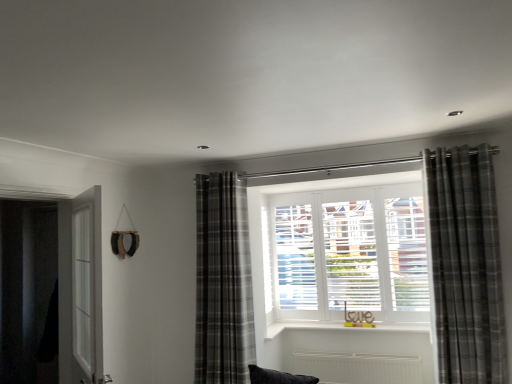
Identify the location of gray plaid curtain at right, which ranks as the 1th curtain in right-to-left order. The image size is (512, 384). (466, 265).

What do you see at coordinates (223, 281) in the screenshot?
I see `gray plaid curtain at center, the 2th curtain in the front-to-back sequence` at bounding box center [223, 281].

Measure the distance between gray plaid curtain at center, the 2th curtain in the front-to-back sequence, and camera.

The depth of gray plaid curtain at center, the 2th curtain in the front-to-back sequence, is 3.10 meters.

At what (x,y) coordinates should I click in order to perform the action: click on gray plaid curtain at right, the second curtain from the back. Please return your answer as a coordinate pair (x, y). Image resolution: width=512 pixels, height=384 pixels. Looking at the image, I should click on (466, 265).

Is black matte door at left surrounding gray plaid curtain at right, the second curtain from the back?

No.

Measure the distance from black matte door at left to gray plaid curtain at right, which appears as the 2th curtain when viewed from the left.

They are 8.54 feet apart.

From the image's perspective, is black matte door at left on top of gray plaid curtain at right, which appears as the 2th curtain when viewed from the left?

No.

Based on the photo, considering the positions of objects black matte door at left and gray plaid curtain at right, which appears as the 1th curtain when viewed from the front, in the image provided, who is behind, black matte door at left or gray plaid curtain at right, which appears as the 1th curtain when viewed from the front,?

gray plaid curtain at right, which appears as the 1th curtain when viewed from the front, is more distant.

In the scene shown: How different are the orientations of gray plaid curtain at center, which ranks as the 1th curtain in back-to-front order, and black matte door at left in degrees?

94 degrees separate the facing orientations of gray plaid curtain at center, which ranks as the 1th curtain in back-to-front order, and black matte door at left.

From the image's perspective, is gray plaid curtain at center, which ranks as the 1th curtain in back-to-front order, positioned above or below black matte door at left?

gray plaid curtain at center, which ranks as the 1th curtain in back-to-front order, is below black matte door at left.

Does point (199, 230) come closer to viewer compared to point (32, 247)?

Yes, point (199, 230) is closer to viewer.

Is gray plaid curtain at center, placed as the 1th curtain when sorted from left to right, to the left or to the right of black matte door at left in the image?

In the image, gray plaid curtain at center, placed as the 1th curtain when sorted from left to right, appears on the right side of black matte door at left.

Which is in front, gray plaid curtain at right, which appears as the 1th curtain when viewed from the front, or clear glass screen door at left?

Positioned in front is clear glass screen door at left.

Would you say clear glass screen door at left is part of gray plaid curtain at right, which appears as the 1th curtain when viewed from the front,'s contents?

No, gray plaid curtain at right, which appears as the 1th curtain when viewed from the front, does not contain clear glass screen door at left.

Can you confirm if gray plaid curtain at right, the second curtain from the back, is taller than clear glass screen door at left?

Yes.

Identify the location of curtain on the left of gray plaid curtain at right, which appears as the 2th curtain when viewed from the left. The image size is (512, 384). (223, 281).

From the image's perspective, is gray plaid curtain at right, which ranks as the 1th curtain in right-to-left order, on top of gray plaid curtain at center, which ranks as the 1th curtain in back-to-front order?

Yes, from the image's perspective, gray plaid curtain at right, which ranks as the 1th curtain in right-to-left order, is above gray plaid curtain at center, which ranks as the 1th curtain in back-to-front order.

Considering the positions of objects gray plaid curtain at right, which appears as the 1th curtain when viewed from the front, and gray plaid curtain at center, positioned as the second curtain in right-to-left order, in the image provided, who is more to the right, gray plaid curtain at right, which appears as the 1th curtain when viewed from the front, or gray plaid curtain at center, positioned as the second curtain in right-to-left order,?

gray plaid curtain at right, which appears as the 1th curtain when viewed from the front.

Which is nearer, (446, 226) or (245, 276)?

The point (446, 226) is in front.

Does point (99, 191) lie behind point (59, 228)?

No, (99, 191) is closer to viewer.

Can you tell me how much clear glass screen door at left and black matte door at left differ in facing direction?

129 degrees.

From a real-world perspective, between clear glass screen door at left and black matte door at left, who is vertically higher?

black matte door at left.

Which object is wider, clear glass screen door at left or black matte door at left?

black matte door at left is wider.

Considering the sizes of objects clear glass screen door at left and gray plaid curtain at center, placed as the 1th curtain when sorted from left to right, in the image provided, who is shorter, clear glass screen door at left or gray plaid curtain at center, placed as the 1th curtain when sorted from left to right,?

Standing shorter between the two is clear glass screen door at left.

Is clear glass screen door at left wider or thinner than gray plaid curtain at center, positioned as the second curtain in right-to-left order?

clear glass screen door at left is thinner than gray plaid curtain at center, positioned as the second curtain in right-to-left order.

Is clear glass screen door at left oriented towards gray plaid curtain at center, placed as the 1th curtain when sorted from left to right?

No.

Considering the sizes of clear glass screen door at left and gray plaid curtain at center, placed as the 1th curtain when sorted from left to right, in the image, is clear glass screen door at left bigger or smaller than gray plaid curtain at center, placed as the 1th curtain when sorted from left to right,?

Considering their sizes, clear glass screen door at left takes up less space than gray plaid curtain at center, placed as the 1th curtain when sorted from left to right.

Which object is thinner, clear glass screen door at left or gray plaid curtain at right, the second curtain from the back?

With smaller width is clear glass screen door at left.

Is point (70, 317) closer or farther from the camera than point (464, 315)?

Clearly, point (70, 317) is more distant from the camera than point (464, 315).

From a real-world perspective, is clear glass screen door at left below gray plaid curtain at right, which appears as the 2th curtain when viewed from the left?

Yes, from a real-world perspective, clear glass screen door at left is below gray plaid curtain at right, which appears as the 2th curtain when viewed from the left.

Can you see clear glass screen door at left touching gray plaid curtain at right, which appears as the 1th curtain when viewed from the front?

No, clear glass screen door at left is not with gray plaid curtain at right, which appears as the 1th curtain when viewed from the front.

Find the location of a particular element. The image size is (512, 384). door in front of the gray plaid curtain at right, which appears as the 2th curtain when viewed from the left is located at coordinates (51, 289).

Image resolution: width=512 pixels, height=384 pixels. In order to click on the 2nd curtain behind when counting from the black matte door at left in this screenshot , I will do `click(223, 281)`.

Which object lies nearer to the anchor point clear glass screen door at left, black matte door at left or gray plaid curtain at center, the 2th curtain in the front-to-back sequence?

black matte door at left is closer to clear glass screen door at left.

Which object lies nearer to the anchor point gray plaid curtain at center, the 2th curtain in the front-to-back sequence, clear glass screen door at left or black matte door at left?

clear glass screen door at left lies closer to gray plaid curtain at center, the 2th curtain in the front-to-back sequence, than the other object.

Looking at the image, which one is located closer to gray plaid curtain at center, the 2th curtain in the front-to-back sequence, clear glass screen door at left or gray plaid curtain at right, which appears as the 1th curtain when viewed from the front?

clear glass screen door at left is positioned closer to the anchor gray plaid curtain at center, the 2th curtain in the front-to-back sequence.

Looking at the image, which one is located closer to gray plaid curtain at center, which ranks as the 1th curtain in back-to-front order, gray plaid curtain at right, which appears as the 2th curtain when viewed from the left, or clear glass screen door at left?

The object closer to gray plaid curtain at center, which ranks as the 1th curtain in back-to-front order, is clear glass screen door at left.

Estimate the real-world distances between objects in this image. Which object is closer to gray plaid curtain at right, which appears as the 2th curtain when viewed from the left, black matte door at left or clear glass screen door at left?

clear glass screen door at left lies closer to gray plaid curtain at right, which appears as the 2th curtain when viewed from the left, than the other object.

Based on their spatial positions, is black matte door at left or gray plaid curtain at center, the 2th curtain in the front-to-back sequence, further from gray plaid curtain at right, which ranks as the 1th curtain in right-to-left order?

Among the two, black matte door at left is located further to gray plaid curtain at right, which ranks as the 1th curtain in right-to-left order.

Which object lies further to the anchor point black matte door at left, gray plaid curtain at right, the second curtain from the back, or gray plaid curtain at center, the 2th curtain in the front-to-back sequence?

Among the two, gray plaid curtain at right, the second curtain from the back, is located further to black matte door at left.

Considering their positions, is gray plaid curtain at center, the 2th curtain in the front-to-back sequence, positioned closer to black matte door at left than clear glass screen door at left?

Based on the image, clear glass screen door at left appears to be nearer to black matte door at left.

The width and height of the screenshot is (512, 384). I want to click on curtain situated between clear glass screen door at left and gray plaid curtain at right, which appears as the 1th curtain when viewed from the front, from left to right, so click(223, 281).

You are a GUI agent. You are given a task and a screenshot of the screen. Output one action in this format:
    pyautogui.click(x=<x>, y=<y>)
    Task: Click on the screen door situated between black matte door at left and gray plaid curtain at center, which ranks as the 1th curtain in back-to-front order, from left to right
    The image size is (512, 384).
    Given the screenshot: What is the action you would take?
    pyautogui.click(x=80, y=289)

You are a GUI agent. You are given a task and a screenshot of the screen. Output one action in this format:
    pyautogui.click(x=<x>, y=<y>)
    Task: Click on the curtain between black matte door at left and gray plaid curtain at right, which ranks as the 1th curtain in right-to-left order, in the horizontal direction
    The image size is (512, 384).
    Given the screenshot: What is the action you would take?
    pyautogui.click(x=223, y=281)

This screenshot has width=512, height=384. In order to click on screen door between black matte door at left and gray plaid curtain at right, the second curtain from the back, from left to right in this screenshot , I will do `click(80, 289)`.